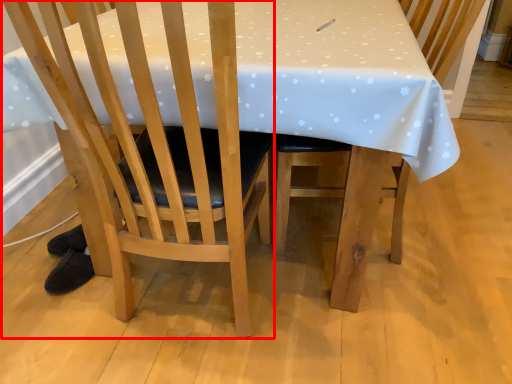
Question: From the image's perspective, what is the correct spatial relationship of chair (annotated by the red box) in relation to chair?

Choices:
 (A) below
 (B) above

Answer: (A)